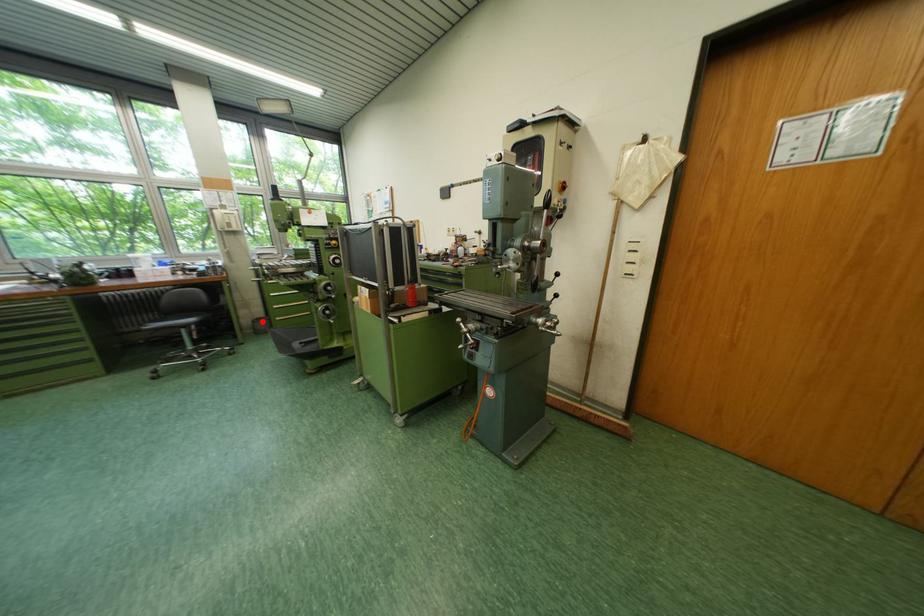
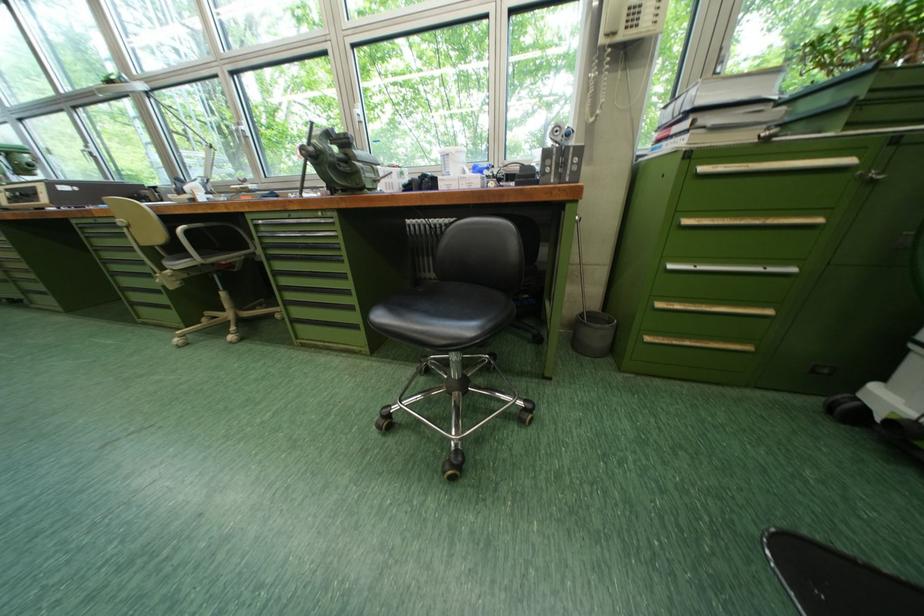
Where in the second image is the point corresponding to the highlighted location from the first image?

(589, 315)